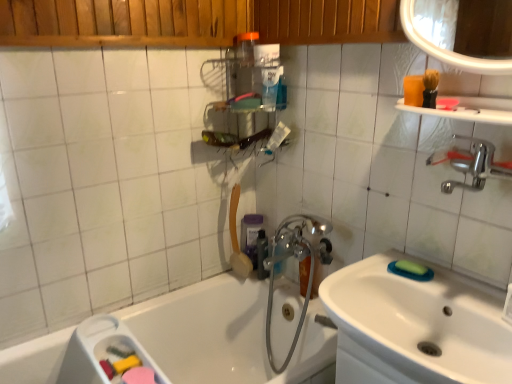
At what (x,y) coordinates should I click in order to perform the action: click on vacant area that lies to the right of green sponge at sink. Please return your answer as a coordinate pair (x, y). This screenshot has width=512, height=384. Looking at the image, I should click on (453, 278).